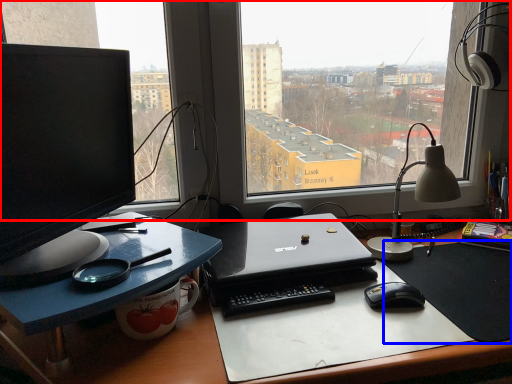
Question: Which object appears farthest to the camera in this image, window (highlighted by a red box) or mousepad (highlighted by a blue box)?

Choices:
 (A) window
 (B) mousepad

Answer: (A)